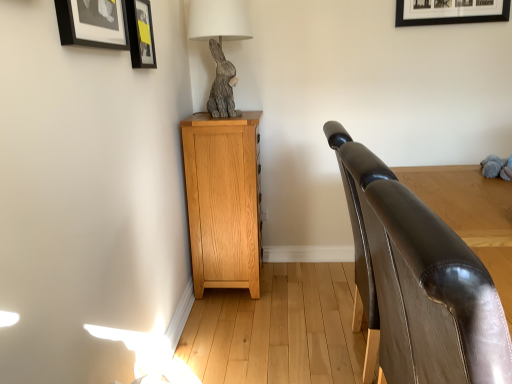
Identify the location of gray plush toy at right. The width and height of the screenshot is (512, 384). (496, 167).

Image resolution: width=512 pixels, height=384 pixels. Identify the location of black matte picture frame at upper left, the first picture frame in the front-to-back sequence. (93, 23).

Where is `shiny brown leather armrest at right`? shiny brown leather armrest at right is located at coordinates (418, 281).

Where is `gray textured rabbit at upper left`? The image size is (512, 384). gray textured rabbit at upper left is located at coordinates (219, 20).

Does point (248, 21) come behind point (256, 291)?

No, it is in front of (256, 291).

Is gray textured rabbit at upper left closer to the viewer compared to light oak cabinet at left?

Yes, gray textured rabbit at upper left is closer to the viewer.

Which of these two, gray textured rabbit at upper left or light oak cabinet at left, is bigger?

light oak cabinet at left is bigger.

From a real-world perspective, between gray textured rabbit at upper left and light oak cabinet at left, who is vertically lower?

From a 3D spatial view, light oak cabinet at left is below.

Would you consider matte black picture frame at upper left, placed as the 2th picture frame when sorted from front to back, to be distant from light oak cabinet at left?

They are positioned close to each other.

In the scene shown: Considering the sizes of objects matte black picture frame at upper left, placed as the 2th picture frame when sorted from front to back, and light oak cabinet at left in the image provided, who is wider, matte black picture frame at upper left, placed as the 2th picture frame when sorted from front to back, or light oak cabinet at left?

Wider between the two is light oak cabinet at left.

Based on their sizes in the image, would you say matte black picture frame at upper left, which is the 1th picture frame from back to front, is bigger or smaller than light oak cabinet at left?

Clearly, matte black picture frame at upper left, which is the 1th picture frame from back to front, is smaller in size than light oak cabinet at left.

There is a light oak cabinet at left. Identify the location of the 1st picture frame above it (from a real-world perspective). This screenshot has height=384, width=512. (141, 34).

Considering the sizes of shiny brown leather armrest at right and matte black picture frame at upper left, placed as the 2th picture frame when sorted from front to back, in the image, is shiny brown leather armrest at right wider or thinner than matte black picture frame at upper left, placed as the 2th picture frame when sorted from front to back,?

shiny brown leather armrest at right is wider than matte black picture frame at upper left, placed as the 2th picture frame when sorted from front to back.

Is shiny brown leather armrest at right facing towards matte black picture frame at upper left, which is the 1th picture frame from back to front?

No, shiny brown leather armrest at right is not oriented towards matte black picture frame at upper left, which is the 1th picture frame from back to front.

From a real-world perspective, is shiny brown leather armrest at right located higher than matte black picture frame at upper left, placed as the 2th picture frame when sorted from front to back?

Incorrect, from a real-world perspective, shiny brown leather armrest at right is lower than matte black picture frame at upper left, placed as the 2th picture frame when sorted from front to back.

Measure the distance from gray textured rabbit at upper left to matte black picture frame at upper left, placed as the 2th picture frame when sorted from front to back.

They are 16.69 inches apart.

Is gray textured rabbit at upper left wider or thinner than matte black picture frame at upper left, placed as the 2th picture frame when sorted from front to back?

Clearly, gray textured rabbit at upper left has more width compared to matte black picture frame at upper left, placed as the 2th picture frame when sorted from front to back.

Looking at this image, from the image's perspective, which is above, gray textured rabbit at upper left or matte black picture frame at upper left, which is the 1th picture frame from back to front?

gray textured rabbit at upper left is shown above in the image.

You are a GUI agent. You are given a task and a screenshot of the screen. Output one action in this format:
    pyautogui.click(x=<x>, y=<y>)
    Task: Click on the 1st picture frame located above the gray textured rabbit at upper left (from a real-world perspective)
    Image resolution: width=512 pixels, height=384 pixels.
    Given the screenshot: What is the action you would take?
    pyautogui.click(x=141, y=34)

Considering the relative positions of light oak cabinet at left and gray plush toy at right in the image provided, is light oak cabinet at left to the left of gray plush toy at right from the viewer's perspective?

Yes.

Considering the sizes of objects light oak cabinet at left and gray plush toy at right in the image provided, who is thinner, light oak cabinet at left or gray plush toy at right?

gray plush toy at right is thinner.

From the image's perspective, which is above, light oak cabinet at left or gray plush toy at right?

gray plush toy at right appears higher in the image.

Considering the relative sizes of light oak cabinet at left and shiny brown leather armrest at right in the image provided, is light oak cabinet at left thinner than shiny brown leather armrest at right?

Incorrect, the width of light oak cabinet at left is not less than that of shiny brown leather armrest at right.

Is the depth of light oak cabinet at left greater than that of shiny brown leather armrest at right?

Yes.

In the scene shown: From their relative heights in the image, would you say light oak cabinet at left is taller or shorter than shiny brown leather armrest at right?

In the image, light oak cabinet at left appears to be taller than shiny brown leather armrest at right.

How far apart are light oak cabinet at left and shiny brown leather armrest at right?

light oak cabinet at left is 3.40 feet from shiny brown leather armrest at right.

Based on the photo, from a real-world perspective, who is located lower, black matte picture frame at upper left, the first picture frame in the front-to-back sequence, or gray plush toy at right?

In real-world perspective, gray plush toy at right is lower.

From the image's perspective, which is above, black matte picture frame at upper left, the first picture frame in the front-to-back sequence, or gray plush toy at right?

black matte picture frame at upper left, the first picture frame in the front-to-back sequence.

Is black matte picture frame at upper left, which is counted as the second picture frame, starting from the back, with gray plush toy at right?

No, black matte picture frame at upper left, which is counted as the second picture frame, starting from the back, is not next to gray plush toy at right.

This screenshot has height=384, width=512. Identify the location of animal below the black matte picture frame at upper left, which is counted as the second picture frame, starting from the back (from the image's perspective). (496, 167).

Identify the location of table lamp that is in front of the light oak cabinet at left. (219, 20).

Identify the location of the 2nd picture frame positioned above the light oak cabinet at left (from the image's perspective). (141, 34).

When comparing their distances from matte black picture frame at upper left, which is the 1th picture frame from back to front, does gray textured rabbit at upper left or black matte picture frame at upper left, the first picture frame in the front-to-back sequence, seem closer?

black matte picture frame at upper left, the first picture frame in the front-to-back sequence.

Estimate the real-world distances between objects in this image. Which object is further from gray plush toy at right, shiny brown leather armrest at right or matte black picture frame at upper left, placed as the 2th picture frame when sorted from front to back?

Among the two, matte black picture frame at upper left, placed as the 2th picture frame when sorted from front to back, is located further to gray plush toy at right.

Which object lies nearer to the anchor point matte black picture frame at upper left, placed as the 2th picture frame when sorted from front to back, light oak cabinet at left or gray textured rabbit at upper left?

Among the two, gray textured rabbit at upper left is located nearer to matte black picture frame at upper left, placed as the 2th picture frame when sorted from front to back.

From the image, which object appears to be nearer to shiny brown leather armrest at right, black matte picture frame at upper left, which is counted as the second picture frame, starting from the back, or gray textured rabbit at upper left?

black matte picture frame at upper left, which is counted as the second picture frame, starting from the back, is closer to shiny brown leather armrest at right.

Looking at the image, which one is located closer to light oak cabinet at left, gray plush toy at right or black matte picture frame at upper left, which is counted as the second picture frame, starting from the back?

black matte picture frame at upper left, which is counted as the second picture frame, starting from the back, lies closer to light oak cabinet at left than the other object.

From the image, which object appears to be farther from gray plush toy at right, light oak cabinet at left or gray textured rabbit at upper left?

gray textured rabbit at upper left lies further to gray plush toy at right than the other object.

Based on their spatial positions, is gray plush toy at right or light oak cabinet at left closer to shiny brown leather armrest at right?

gray plush toy at right lies closer to shiny brown leather armrest at right than the other object.

Looking at this image, from the image, which object appears to be nearer to shiny brown leather armrest at right, light oak cabinet at left or gray textured rabbit at upper left?

light oak cabinet at left is positioned closer to the anchor shiny brown leather armrest at right.

This screenshot has height=384, width=512. Identify the location of picture frame between matte black picture frame at upper left, which is the 1th picture frame from back to front, and shiny brown leather armrest at right, in the vertical direction. (93, 23).

The image size is (512, 384). I want to click on furniture between gray textured rabbit at upper left and gray plush toy at right in the horizontal direction, so click(x=418, y=281).

Locate an element on the screen. furniture situated between light oak cabinet at left and gray plush toy at right from left to right is located at coordinates pyautogui.click(x=418, y=281).

At what (x,y) coordinates should I click in order to perform the action: click on furniture located between black matte picture frame at upper left, the first picture frame in the front-to-back sequence, and gray plush toy at right in the left-right direction. Please return your answer as a coordinate pair (x, y). This screenshot has height=384, width=512. Looking at the image, I should click on (418, 281).